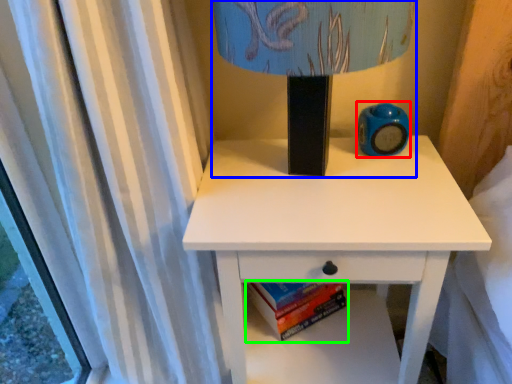
Question: Which is farther away from teal (highlighted by a red box)? table lamp (highlighted by a blue box) or paperback book (highlighted by a green box)?

Choices:
 (A) table lamp
 (B) paperback book

Answer: (B)